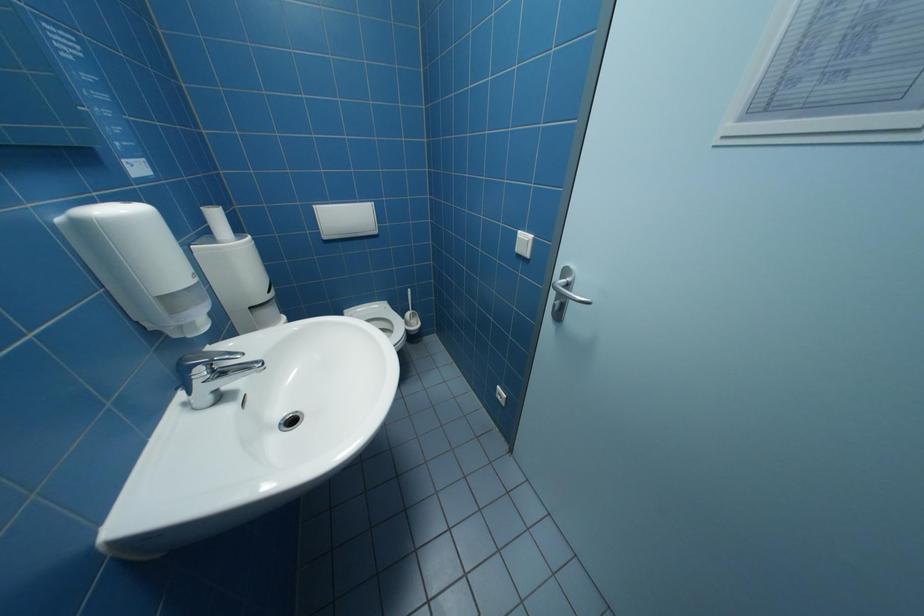
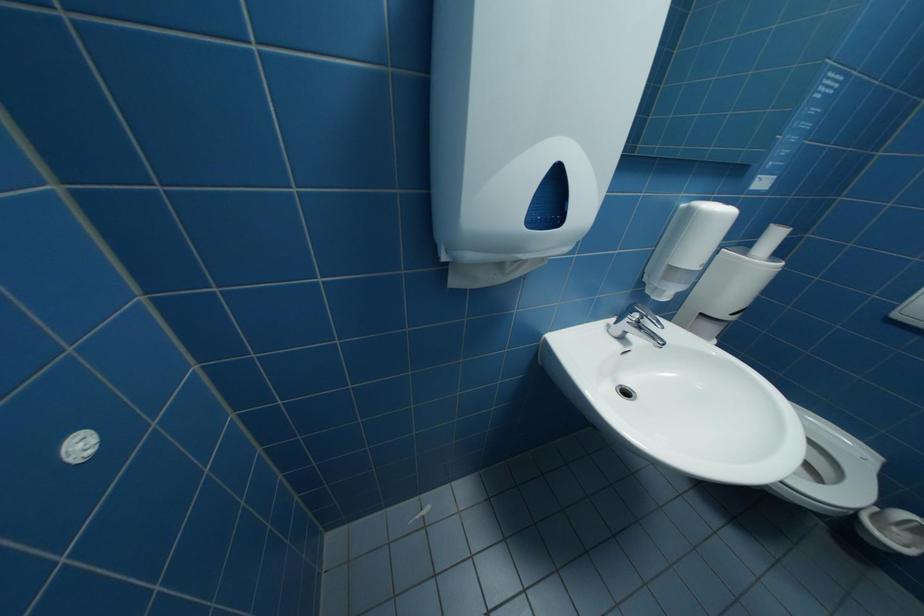
The images are taken continuously from a first-person perspective. In which direction is your viewpoint rotating?

The camera's rotation is toward left-down.